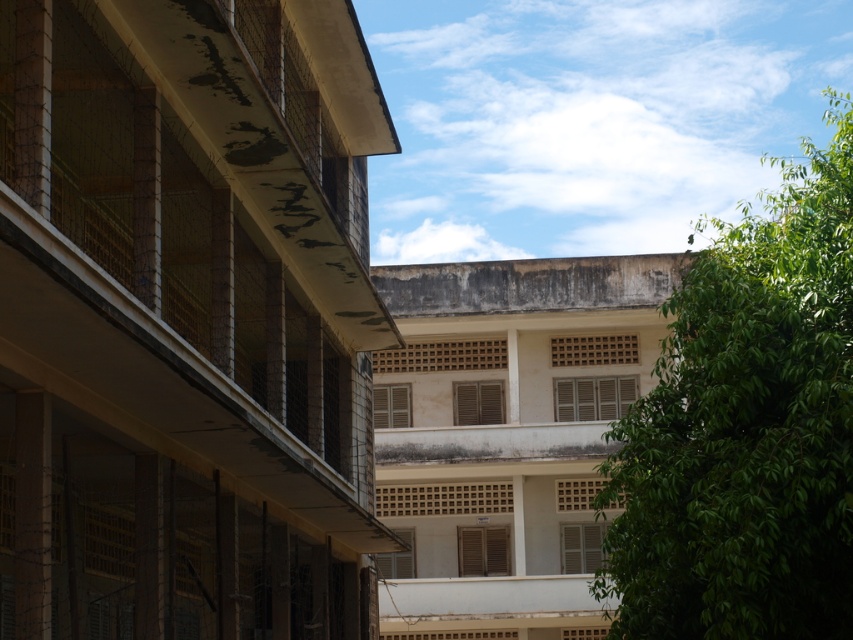
Does concrete textured balcony at left appear on the right side of green leafy tree at upper right?

Incorrect, concrete textured balcony at left is not on the right side of green leafy tree at upper right.

Can you confirm if concrete textured balcony at left is taller than green leafy tree at upper right?

No, concrete textured balcony at left is not taller than green leafy tree at upper right.

Describe the element at coordinates (186, 289) in the screenshot. The image size is (853, 640). I see `concrete textured balcony at left` at that location.

This screenshot has width=853, height=640. I want to click on concrete textured balcony at left, so click(186, 289).